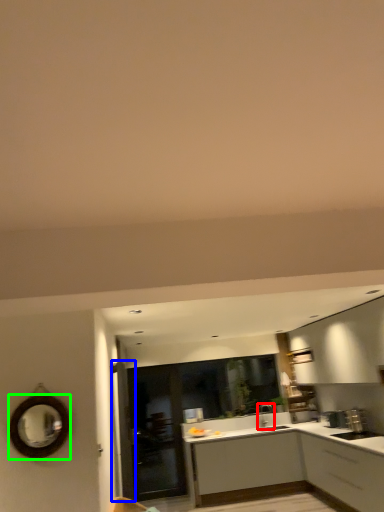
Question: Considering the real-world distances, which object is closest to tap (highlighted by a red box)? door (highlighted by a blue box) or mirror (highlighted by a green box).

Choices:
 (A) door
 (B) mirror

Answer: (A)